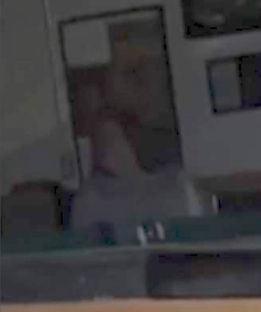
Identify the location of wall. Image resolution: width=261 pixels, height=312 pixels. point(52,135).